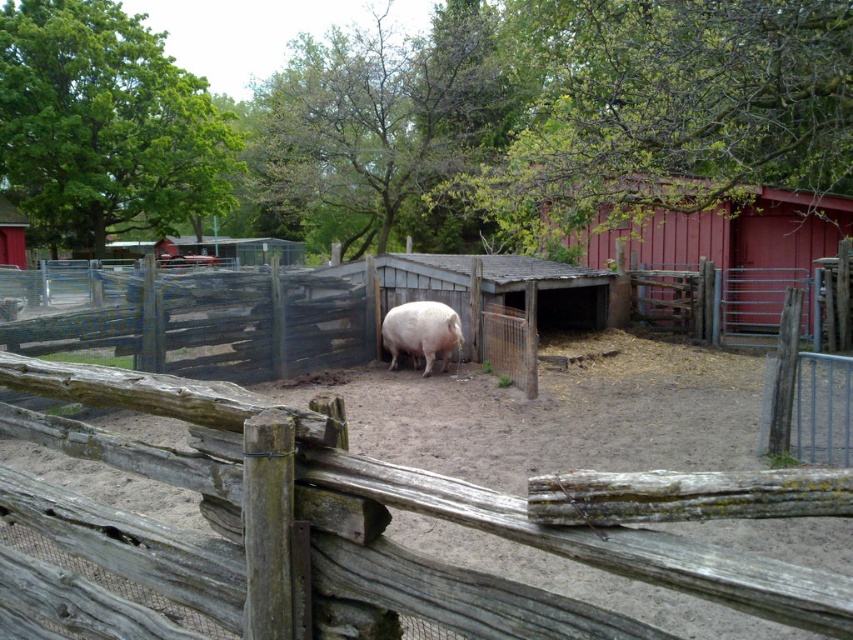
Question: Does wooden fence at left lie behind pink matte pig at center?

Choices:
 (A) yes
 (B) no

Answer: (B)

Question: Which of the following is the farthest from the observer?

Choices:
 (A) (442, 308)
 (B) (757, 212)

Answer: (B)

Question: Can you confirm if wooden fence at left is positioned above weathered wood fence at center?

Choices:
 (A) no
 (B) yes

Answer: (B)

Question: Can you confirm if wooden fence at left is positioned below weathered wood fence at center?

Choices:
 (A) no
 (B) yes

Answer: (A)

Question: Which is nearer to the pink matte pig at center?

Choices:
 (A) wooden fence at left
 (B) weathered wood fence at center
 (C) smooth wooden barn at center right

Answer: (A)

Question: Which object is the closest to the weathered wood fence at center?

Choices:
 (A) smooth wooden barn at center right
 (B) wooden fence at left
 (C) pink matte pig at center

Answer: (B)